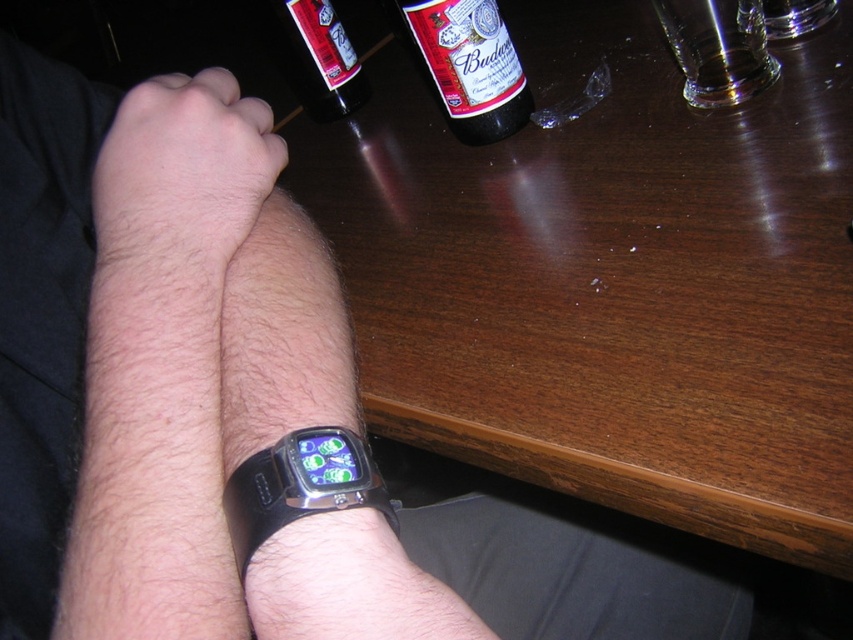
Question: Observing the image, what is the correct spatial positioning of black rubber watch at lower center in reference to bottle glass at upper center?

Choices:
 (A) above
 (B) below

Answer: (B)

Question: Which of these objects is positioned closest to the hair/fuzzy skin at upper center?

Choices:
 (A) black rubber watch at lower center
 (B) bottle glass at upper center

Answer: (A)

Question: Can you confirm if transparent glass mug at upper center is thinner than bottle glass at upper center?

Choices:
 (A) yes
 (B) no

Answer: (A)

Question: Which of these objects is positioned closest to the black rubber watch at lower center?

Choices:
 (A) transparent glass mug at upper center
 (B) bottle glass at upper center
 (C) hair/fuzzy skin at upper center
 (D) bottle at upper center

Answer: (C)

Question: Can you confirm if bottle at upper center is thinner than transparent glass mug at upper center?

Choices:
 (A) yes
 (B) no

Answer: (B)

Question: Which is farther from the transparent glass mug at upper center?

Choices:
 (A) bottle at upper center
 (B) bottle glass at upper center
 (C) black rubber watch at lower center
 (D) hair/fuzzy skin at upper center

Answer: (C)